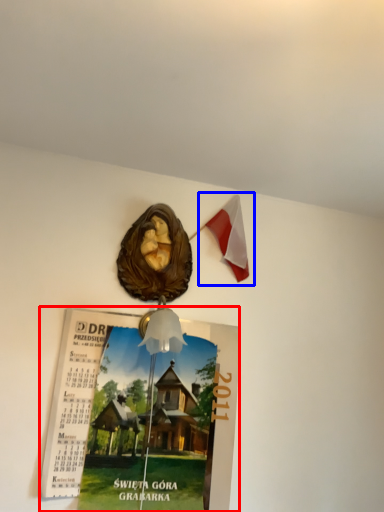
Question: Which of the following is the farthest to the observer, poster page (highlighted by a red box) or flag (highlighted by a blue box)?

Choices:
 (A) poster page
 (B) flag

Answer: (B)